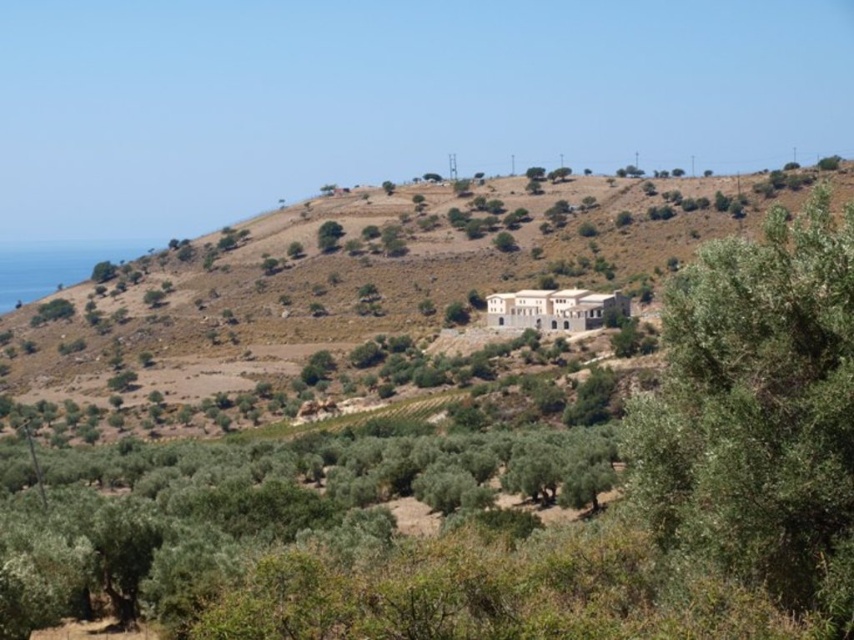
Question: Considering the real-world distances, which object is farthest from the green leafy tree at upper center?

Choices:
 (A) green leafy tree at center-right
 (B) beige stone building at center

Answer: (A)

Question: Can you confirm if green leafy tree at center-right is thinner than green leafy tree at upper center?

Choices:
 (A) no
 (B) yes

Answer: (A)

Question: Does green leafy tree at center-right appear on the right side of green leafy tree at upper center?

Choices:
 (A) no
 (B) yes

Answer: (B)

Question: Which object is the farthest from the green leafy tree at center-right?

Choices:
 (A) beige stone building at center
 (B) green leafy tree at upper center

Answer: (B)

Question: Does beige stone building at center appear on the right side of green leafy tree at center-right?

Choices:
 (A) no
 (B) yes

Answer: (A)

Question: Which point is closer to the camera?

Choices:
 (A) green leafy tree at upper center
 (B) beige stone building at center
 (C) green leafy tree at center-right

Answer: (C)